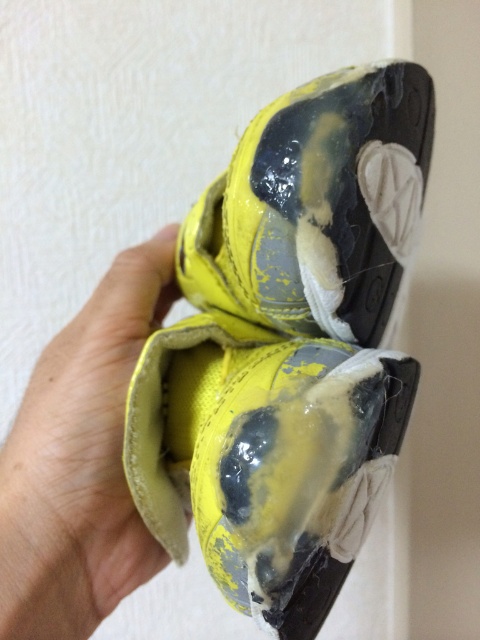
Does yellow matte shoe at center appear over yellow leather hand at center?

Yes.

Which is more to the left, yellow matte shoe at center or yellow leather hand at center?

yellow leather hand at center

Between point (242, 356) and point (56, 493), which one is positioned in front?

Point (56, 493) is in front.

You are a GUI agent. You are given a task and a screenshot of the screen. Output one action in this format:
    pyautogui.click(x=<x>, y=<y>)
    Task: Click on the yellow matte shoe at center
    
    Given the screenshot: What is the action you would take?
    pyautogui.click(x=288, y=346)